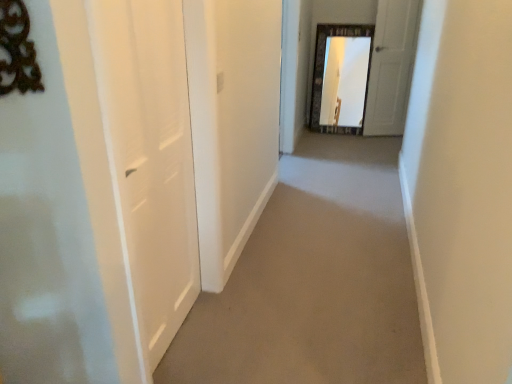
Question: Is beige carpet at center bigger or smaller than white matte door at left, the second door from the top?

Choices:
 (A) big
 (B) small

Answer: (A)

Question: Considering the positions of beige carpet at center and white matte door at left, which appears as the 1th door when viewed from the left, in the image, is beige carpet at center taller or shorter than white matte door at left, which appears as the 1th door when viewed from the left,?

Choices:
 (A) short
 (B) tall

Answer: (A)

Question: Which object is the closest to the white matte door at left, which is counted as the second door, starting from the back?

Choices:
 (A) white matte door at upper right, positioned as the 1th door in back-to-front order
 (B) beige carpet at center

Answer: (B)

Question: Which object is positioned farthest from the white matte door at upper right, positioned as the second door in left-to-right order?

Choices:
 (A) beige carpet at center
 (B) white matte door at left, which appears as the 1th door when viewed from the left

Answer: (B)